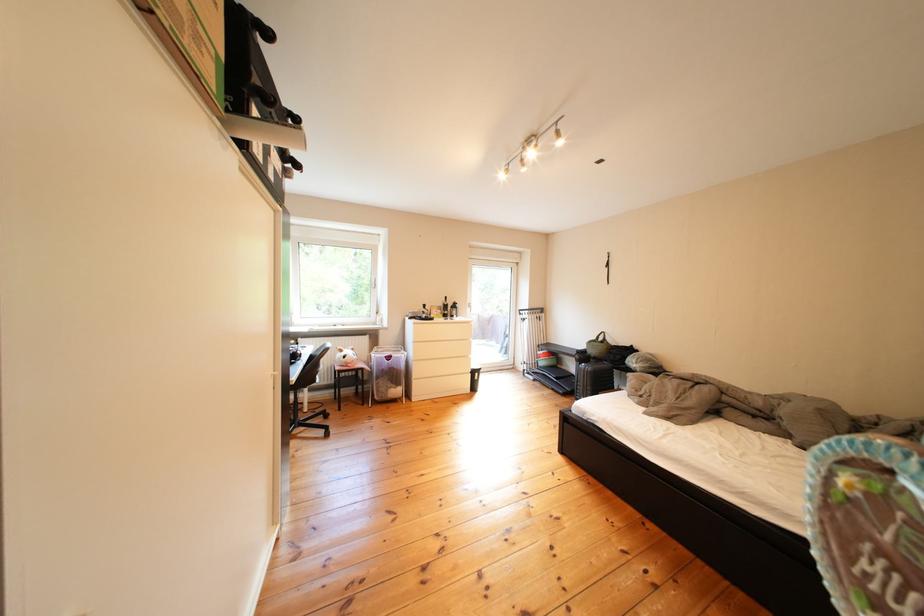
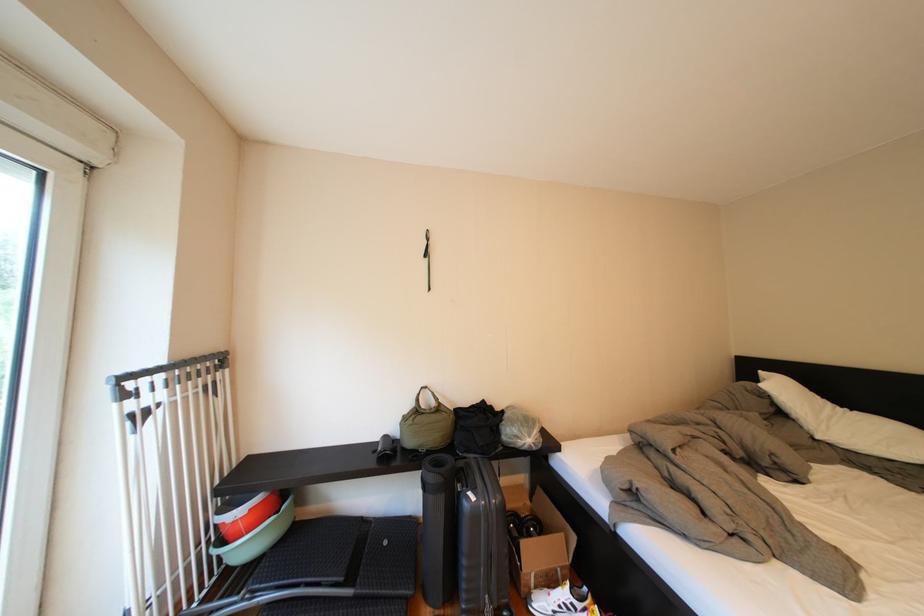
In the second image, find the point that corresponds to point (553, 315) in the first image.

(224, 369)